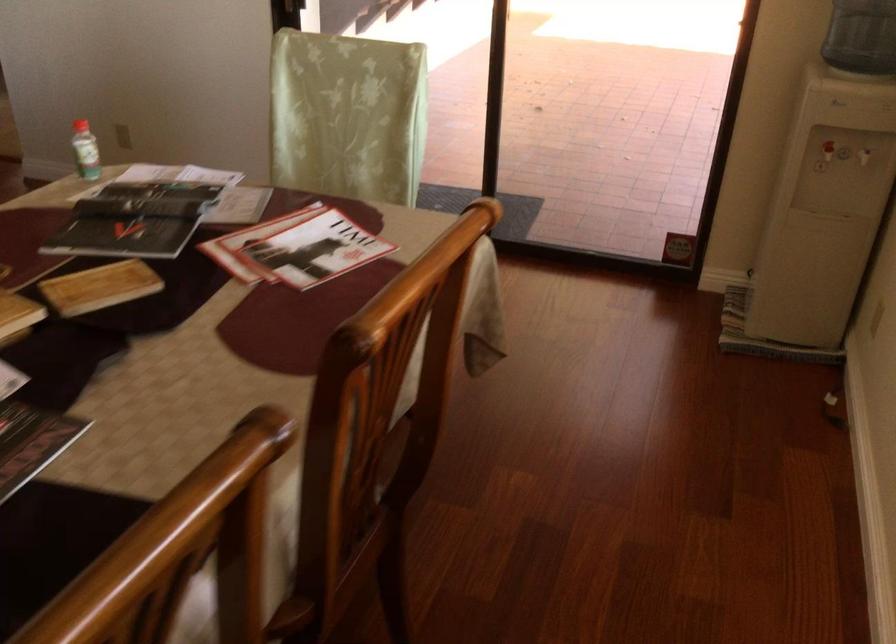
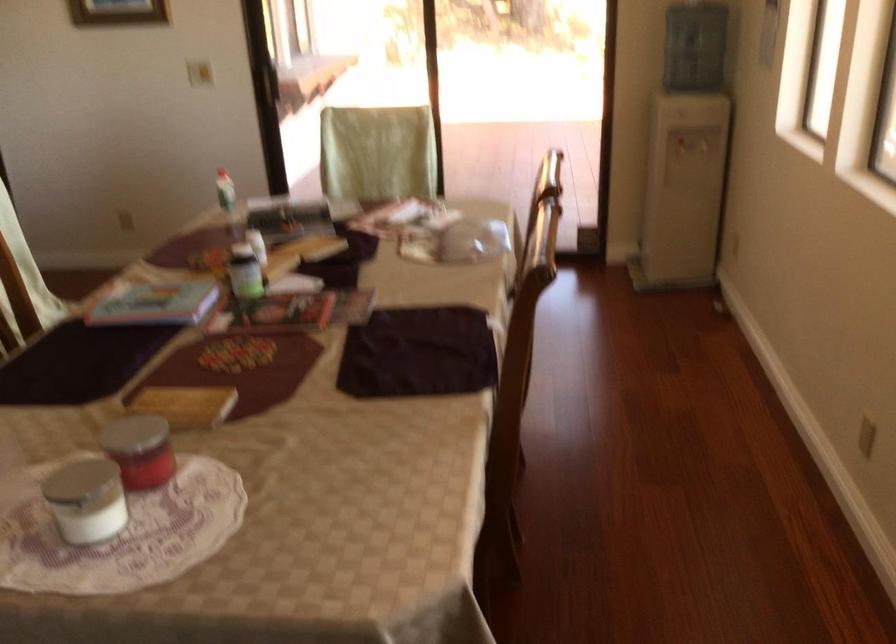
The point at (90, 151) is marked in the first image. Where is the corresponding point in the second image?

(225, 190)